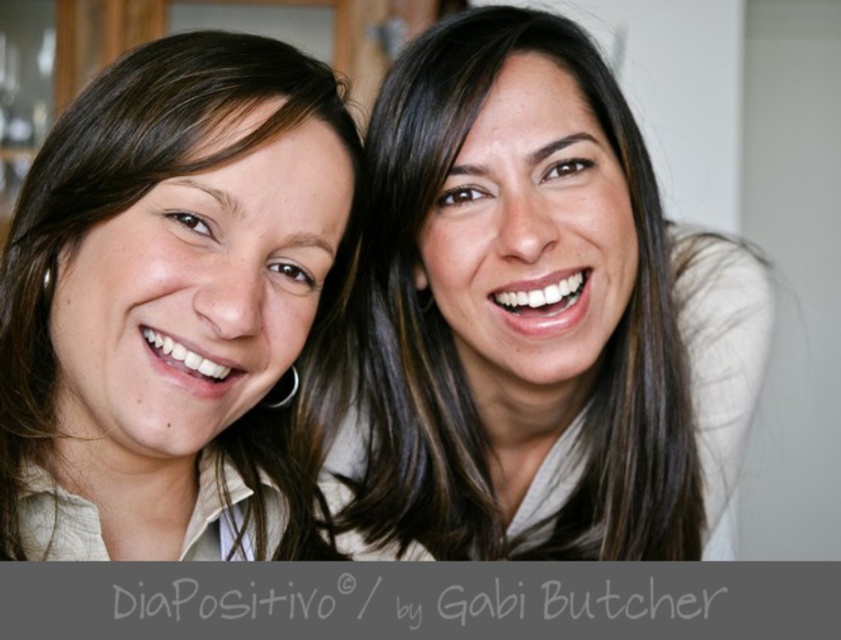
Looking at this image, based on the scene description, which object is bigger between the smooth skin face at upper right and the matte beige shirt at left?

The smooth skin face at upper right is larger in size compared to the matte beige shirt at left according to the description.

You are a photographer setting up for a portrait session. You notice the smooth skin face at upper right and the matte beige shirt at left in your frame. Which object should you adjust to ensure the face is fully visible without being blocked by the shirt?

The smooth skin face at upper right is positioned under the matte beige shirt at left, so you should adjust the matte beige shirt at left to move it upwards or the face downwards to ensure visibility.